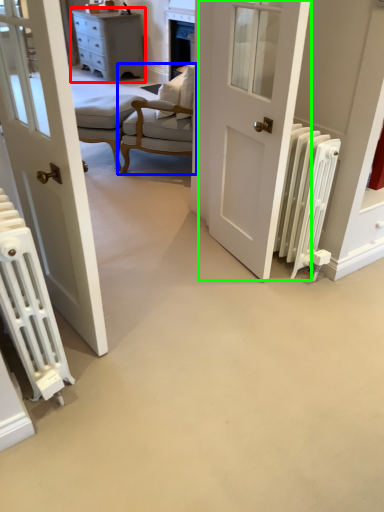
Question: Which object is positioned closest to chest of drawers (highlighted by a red box)? Select from chair (highlighted by a blue box) and door (highlighted by a green box).

Choices:
 (A) chair
 (B) door

Answer: (A)